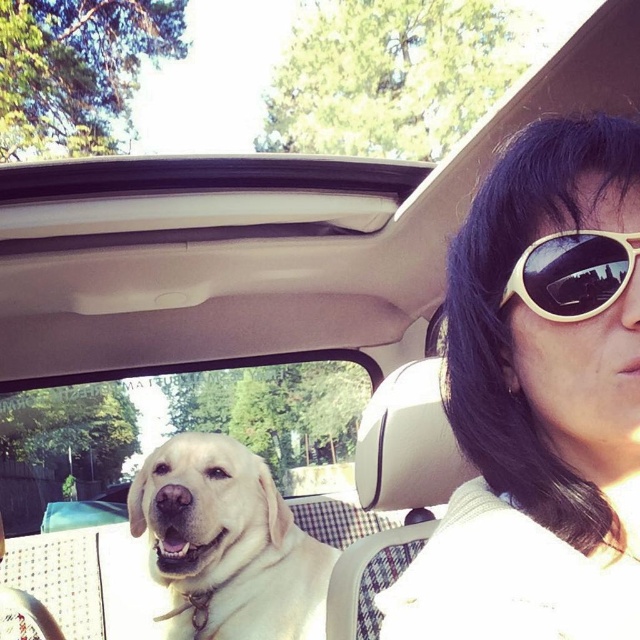
Can you confirm if yellow fur dog at center is positioned above white plastic sunglasses at upper right?

No, yellow fur dog at center is not above white plastic sunglasses at upper right.

Can you confirm if yellow fur dog at center is smaller than white plastic sunglasses at upper right?

Actually, yellow fur dog at center might be larger than white plastic sunglasses at upper right.

Does point (282, 586) come closer to viewer compared to point (561, 230)?

No, (282, 586) is behind (561, 230).

You are a GUI agent. You are given a task and a screenshot of the screen. Output one action in this format:
    pyautogui.click(x=<x>, y=<y>)
    Task: Click on the yellow fur dog at center
    The image size is (640, 640).
    Given the screenshot: What is the action you would take?
    pyautogui.click(x=227, y=544)

Which is in front, point (120, 461) or point (227, 476)?

Positioned in front is point (227, 476).

Is clear glass window at center bigger than yellow fur dog at center?

Yes, clear glass window at center is bigger than yellow fur dog at center.

Which is behind, point (310, 385) or point (321, 609)?

Point (310, 385)

Where is `clear glass window at center`? The image size is (640, 640). clear glass window at center is located at coordinates (170, 429).

Between white matte sunglasses at upper right and clear glass window at center, which one is positioned lower?

Positioned lower is clear glass window at center.

Does point (458, 624) come closer to viewer compared to point (355, 410)?

Yes, point (458, 624) is closer to viewer.

Does point (589, 250) come in front of point (65, 458)?

Yes, it is in front of point (65, 458).

Identify the location of white matte sunglasses at upper right. (540, 401).